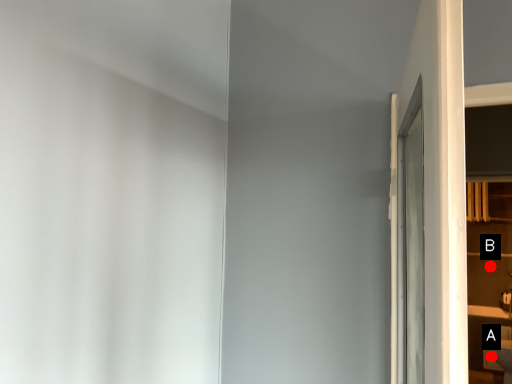
Question: Two points are circled on the image, labeled by A and B beside each circle. Among these points, which one is nearest to the camera?

Choices:
 (A) A is closer
 (B) B is closer

Answer: (A)